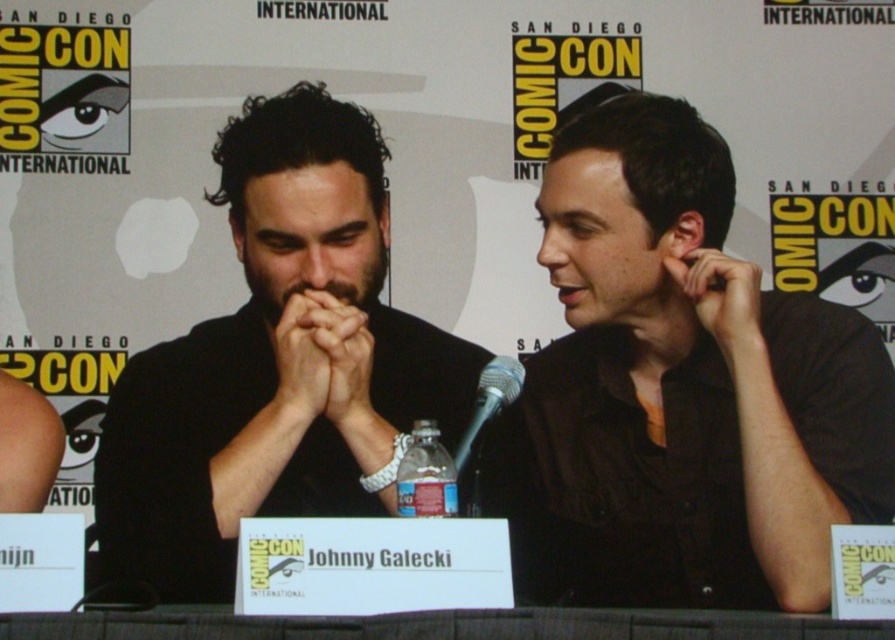
Image resolution: width=895 pixels, height=640 pixels. I want to click on black matte shirt at left, so click(276, 364).

Does black matte shirt at left have a smaller size compared to silver metallic microphone at center?

No.

Is point (129, 419) positioned after point (455, 472)?

That is True.

Find the location of `black matte shirt at left`. black matte shirt at left is located at coordinates (276, 364).

Can you confirm if black matte shirt at center is positioned above black matte shirt at left?

No, black matte shirt at center is not above black matte shirt at left.

Is point (882, 506) positioned before point (126, 554)?

Yes, point (882, 506) is in front of point (126, 554).

At what (x,y) coordinates should I click in order to perform the action: click on black matte shirt at center. Please return your answer as a coordinate pair (x, y). This screenshot has height=640, width=895. Looking at the image, I should click on (688, 385).

Who is positioned more to the left, black matte shirt at center or silver metallic microphone at center?

From the viewer's perspective, silver metallic microphone at center appears more on the left side.

Locate an element on the screen. black matte shirt at center is located at coordinates (688, 385).

Is point (618, 208) farther from viewer compared to point (454, 452)?

No, (618, 208) is in front of (454, 452).

Identify the location of black matte shirt at center. This screenshot has width=895, height=640. (688, 385).